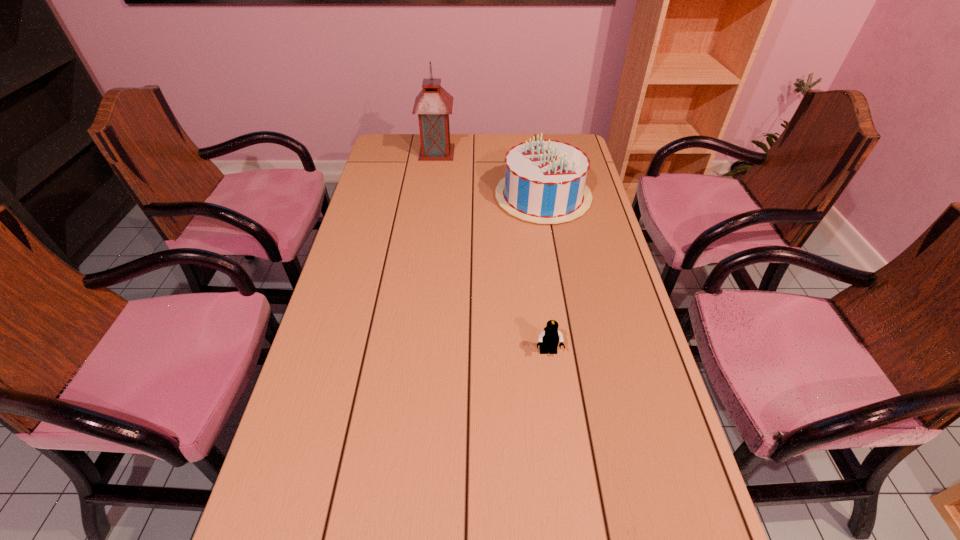
Where is `the tallest object`? the tallest object is located at coordinates (433, 104).

Locate an element on the screen. the farthest object is located at coordinates (433, 104).

Locate an element on the screen. the second farthest object is located at coordinates (545, 180).

You are a GUI agent. You are given a task and a screenshot of the screen. Output one action in this format:
    pyautogui.click(x=<x>, y=<y>)
    Task: Click on the birthday cake
    The image size is (960, 540).
    Given the screenshot: What is the action you would take?
    pyautogui.click(x=545, y=180)

Find the location of a particular element. This screenshot has width=960, height=540. Lego is located at coordinates (549, 338).

The width and height of the screenshot is (960, 540). What are the coordinates of `the nearest object` in the screenshot? It's located at (549, 338).

What are the coordinates of `free space located 0.190m on the right of the lantern` in the screenshot? It's located at (501, 152).

Identify the location of vacant space located on the left of the second tallest object. (402, 197).

Identify the location of vacant space located 0.070m on the front-facing side of the shortest object. The image size is (960, 540). (552, 384).

Find the location of a particular element. This screenshot has width=960, height=540. object located at the far edge is located at coordinates (433, 104).